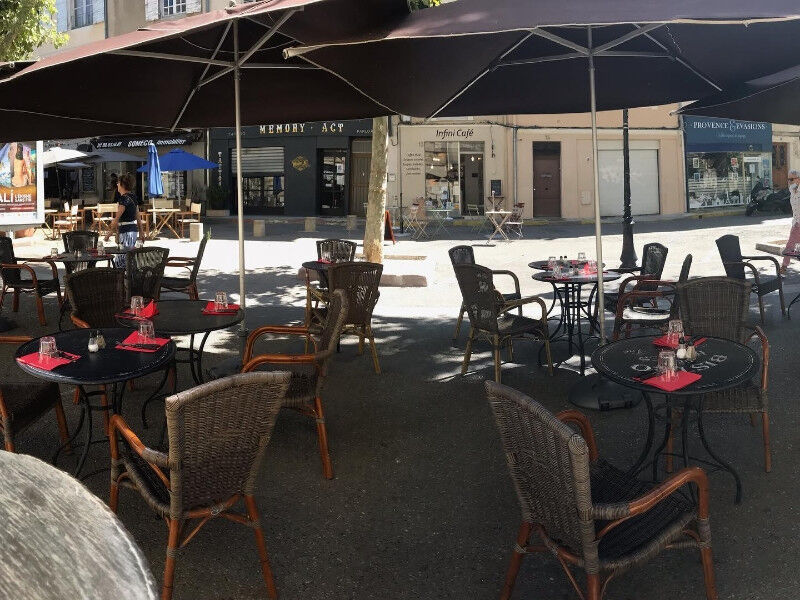
In order to click on napkin in this screenshot , I will do `click(676, 378)`, `click(670, 337)`, `click(54, 356)`, `click(150, 345)`.